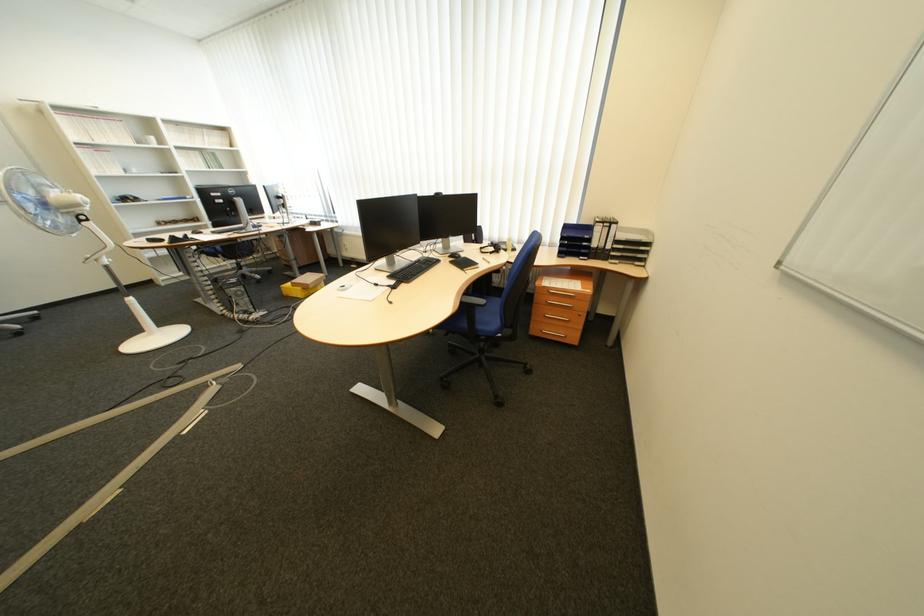
Where is `black headphones`? The height and width of the screenshot is (616, 924). black headphones is located at coordinates (491, 246).